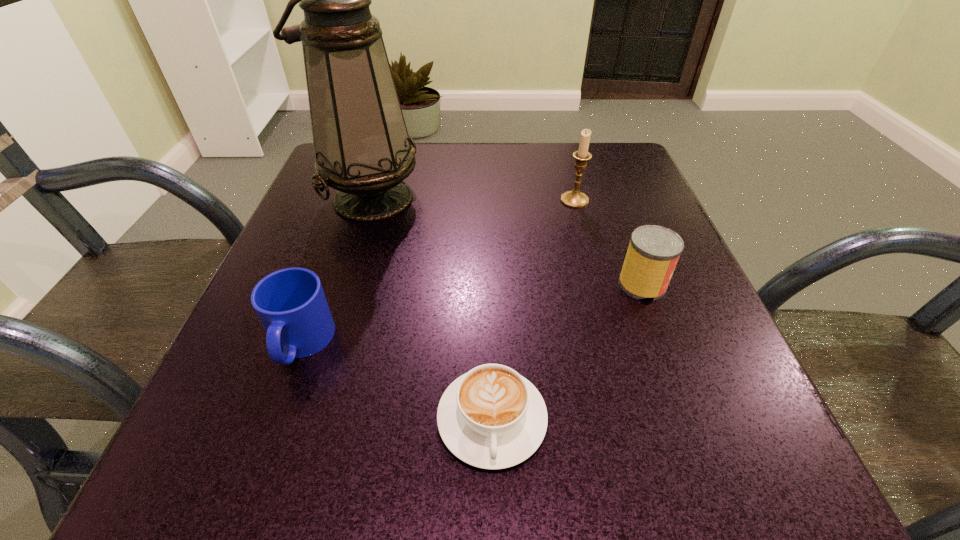
This screenshot has width=960, height=540. What are the coordinates of `free space between the tallest object and the shortest object` in the screenshot? It's located at (432, 308).

I want to click on free space between the oil lamp and the rightmost object, so click(x=507, y=241).

This screenshot has height=540, width=960. What are the coordinates of `blank region between the oil lamp and the shortest object` in the screenshot? It's located at (432, 308).

You are a GUI agent. You are given a task and a screenshot of the screen. Output one action in this format:
    pyautogui.click(x=<x>, y=<y>)
    Task: Click on the vacant point located between the candle holder and the shortest object
    The height and width of the screenshot is (540, 960).
    Given the screenshot: What is the action you would take?
    pyautogui.click(x=534, y=309)

Identify the location of empty location between the third farthest object and the second tallest object. The height and width of the screenshot is (540, 960). (609, 242).

Where is `free space between the third object from right to left and the second tallest object`? Image resolution: width=960 pixels, height=540 pixels. free space between the third object from right to left and the second tallest object is located at coordinates (x=534, y=309).

What are the coordinates of `vacant space in between the cappuccino and the candle holder` in the screenshot? It's located at (534, 309).

Select which object appears as the third closest to the mug. Please provide its 2D coordinates. Your answer should be formatted as a tuple, i.e. [(x, y)], where the tuple contains the x and y coordinates of a point satisfying the conditions above.

[(653, 252)]

Locate an element on the screen. object that stands as the third closest to the third nearest object is located at coordinates (362, 148).

Identify the location of vacant region that satisfies the following two spatial constraints: 1. on the front side of the oil lamp; 2. on the right side of the third farthest object. The image size is (960, 540). (344, 285).